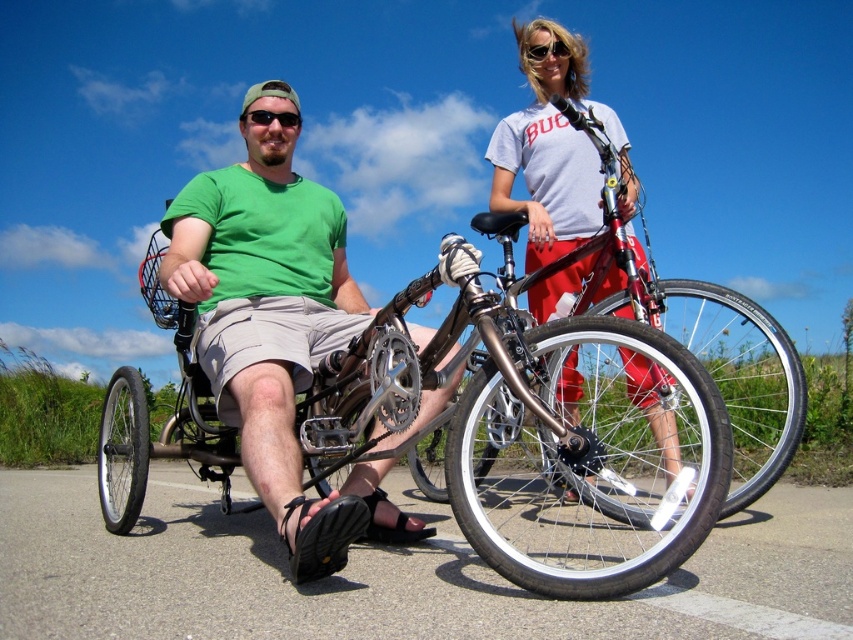
Who is lower down, shiny silver bicycle at center or black matte sunglasses at center?

shiny silver bicycle at center is below.

The width and height of the screenshot is (853, 640). Identify the location of shiny silver bicycle at center. (712, 353).

Is shiny silver bicycle at center closer to the viewer compared to white cotton t-shirt at upper center?

No, it is not.

What do you see at coordinates (712, 353) in the screenshot? I see `shiny silver bicycle at center` at bounding box center [712, 353].

Which is in front, point (621, 257) or point (590, 253)?

Point (621, 257)

Locate an element on the screen. Image resolution: width=853 pixels, height=640 pixels. shiny silver bicycle at center is located at coordinates (712, 353).

Between green matte shirt at center and white cotton t-shirt at upper center, which one has more height?

green matte shirt at center

Does point (341, 264) come closer to viewer compared to point (544, 225)?

No, (341, 264) is further to viewer.

At what (x,y) coordinates should I click in order to perform the action: click on green matte shirt at center. Please return your answer as a coordinate pair (x, y). The height and width of the screenshot is (640, 853). Looking at the image, I should click on (276, 333).